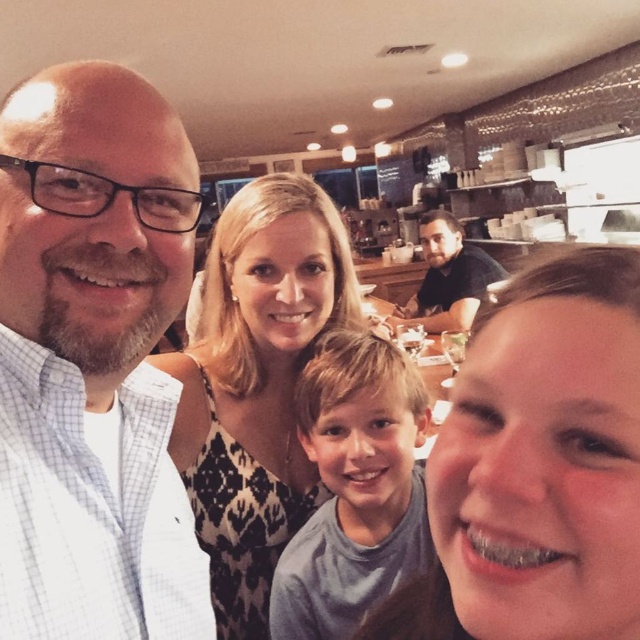
Question: From the image, what is the correct spatial relationship of gray cotton shirt at center in relation to dark brown leather jacket at center?

Choices:
 (A) below
 (B) above

Answer: (A)

Question: Can you confirm if smooth skin face at lower right is positioned above black printed dress at center?

Choices:
 (A) yes
 (B) no

Answer: (B)

Question: Which object is closer to the camera taking this photo?

Choices:
 (A) dark brown leather jacket at center
 (B) white checkered shirt at left
 (C) smooth skin face at lower right
 (D) black printed dress at center

Answer: (C)

Question: Among these objects, which one is farthest from the camera?

Choices:
 (A) smooth skin face at lower right
 (B) black printed dress at center
 (C) gray cotton shirt at center
 (D) white checkered shirt at left

Answer: (B)

Question: Can you confirm if smooth skin face at lower right is smaller than black printed dress at center?

Choices:
 (A) yes
 (B) no

Answer: (A)

Question: Which object is farther from the camera taking this photo?

Choices:
 (A) smooth skin face at lower right
 (B) white checkered shirt at left

Answer: (B)